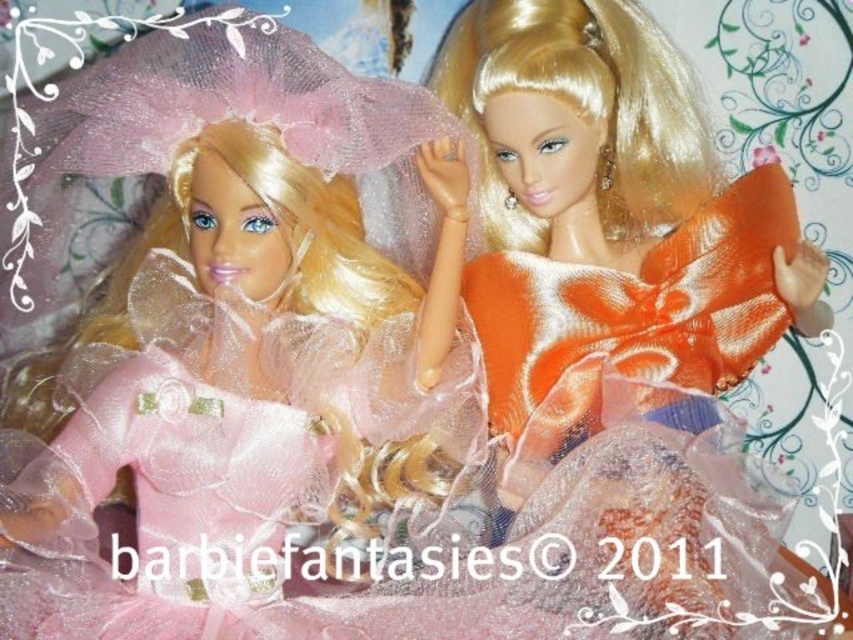
What do you see at coordinates (241, 333) in the screenshot? I see `matte pink tulle dress at left` at bounding box center [241, 333].

Who is positioned more to the left, matte pink tulle dress at left or orange satin dress at upper right?

From the viewer's perspective, matte pink tulle dress at left appears more on the left side.

Locate an element on the screen. This screenshot has width=853, height=640. matte pink tulle dress at left is located at coordinates (241, 333).